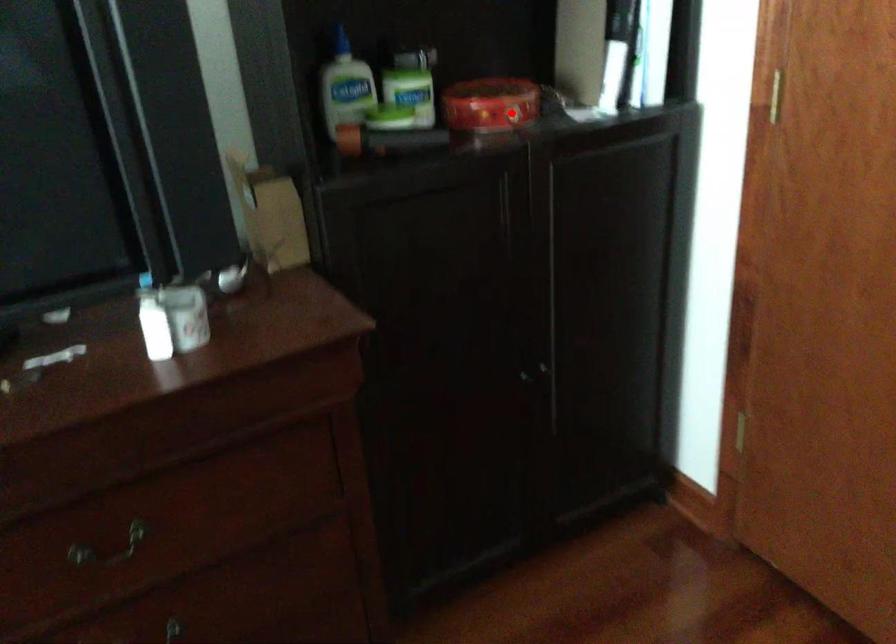
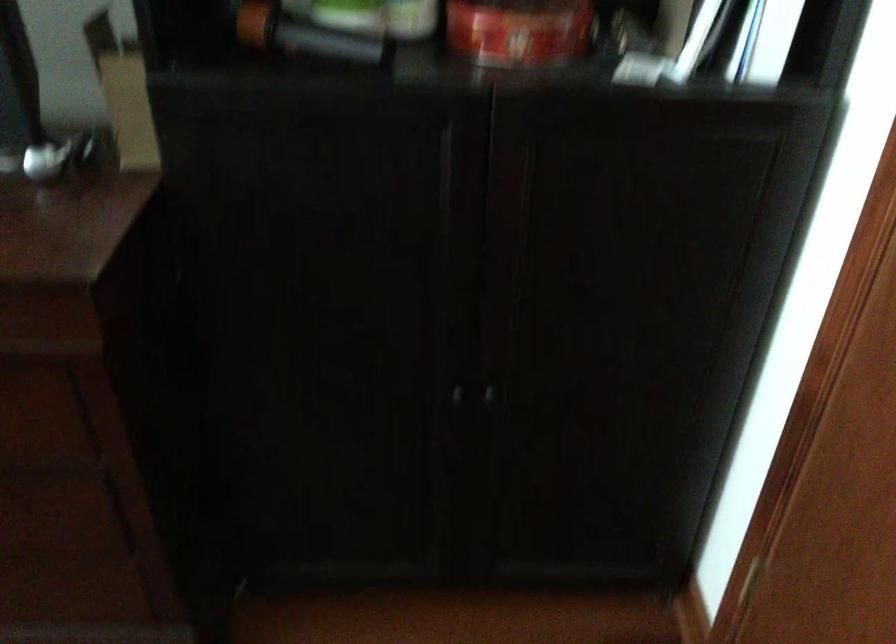
Find the pixel in the second image that matches the highlighted location in the first image.

(519, 31)